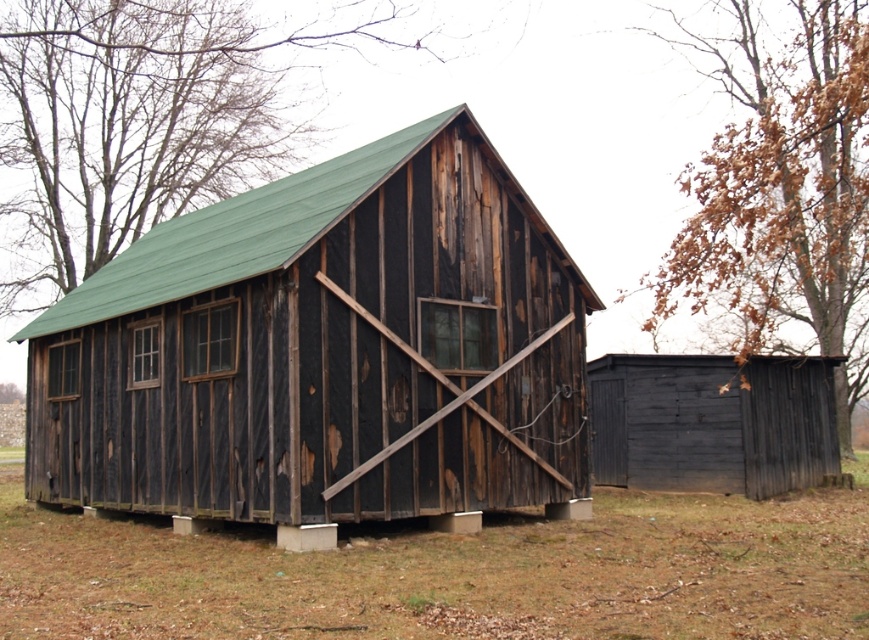
Does brown wood tree at upper right appear on the left side of dark brown wooden shed at right?

No, brown wood tree at upper right is not to the left of dark brown wooden shed at right.

The height and width of the screenshot is (640, 869). What do you see at coordinates (781, 189) in the screenshot?
I see `brown wood tree at upper right` at bounding box center [781, 189].

Where is `brown wood tree at upper right`? brown wood tree at upper right is located at coordinates (781, 189).

Who is taller, rusty wood barn at center or dark brown wooden shed at right?

Standing taller between the two is rusty wood barn at center.

Is rusty wood barn at center thinner than dark brown wooden shed at right?

Incorrect, rusty wood barn at center's width is not less than dark brown wooden shed at right's.

This screenshot has width=869, height=640. What do you see at coordinates (324, 353) in the screenshot?
I see `rusty wood barn at center` at bounding box center [324, 353].

Locate an element on the screen. rusty wood barn at center is located at coordinates (324, 353).

Consider the image. Can you confirm if rusty wood barn at center is wider than green wood tree at upper center?

In fact, rusty wood barn at center might be narrower than green wood tree at upper center.

Can you confirm if rusty wood barn at center is bigger than green wood tree at upper center?

Incorrect, rusty wood barn at center is not larger than green wood tree at upper center.

Is point (568, 422) behind point (187, 28)?

No, it is in front of (187, 28).

Identify the location of rusty wood barn at center. This screenshot has height=640, width=869. pyautogui.click(x=324, y=353).